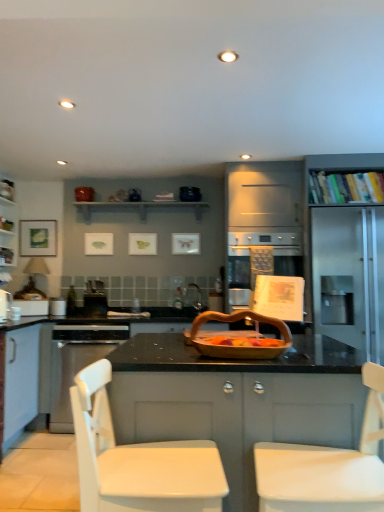
Question: Can you confirm if white matte cabinet at center, the second cabinetry positioned from the back, is taller than matte black shelf at upper center, the first shelf viewed from the left?

Choices:
 (A) yes
 (B) no

Answer: (A)

Question: Is matte black shelf at upper center, placed as the second shelf when sorted from right to left, located within white matte cabinet at center, which appears as the 1th cabinetry when viewed from the right?

Choices:
 (A) no
 (B) yes

Answer: (A)

Question: Considering the relative sizes of white matte cabinet at center, marked as the second cabinetry in a top-to-bottom arrangement, and matte black shelf at upper center, placed as the second shelf when sorted from right to left, in the image provided, is white matte cabinet at center, marked as the second cabinetry in a top-to-bottom arrangement, smaller than matte black shelf at upper center, placed as the second shelf when sorted from right to left,?

Choices:
 (A) yes
 (B) no

Answer: (B)

Question: Does white matte cabinet at center, which appears as the 1th cabinetry when viewed from the right, have a greater width compared to matte black shelf at upper center, the 1th shelf viewed from the back?

Choices:
 (A) yes
 (B) no

Answer: (A)

Question: Is white matte cabinet at center, positioned as the 1th cabinetry in front-to-back order, oriented away from matte black shelf at upper center, the first shelf viewed from the left?

Choices:
 (A) no
 (B) yes

Answer: (A)

Question: Is white matte cabinet at center, marked as the second cabinetry in a top-to-bottom arrangement, far from matte black shelf at upper center, the first shelf viewed from the left?

Choices:
 (A) no
 (B) yes

Answer: (B)

Question: Is brushed metal toaster at center, acting as the 1th appliance starting from the right, positioned behind matte white picture frame at left?

Choices:
 (A) yes
 (B) no

Answer: (B)

Question: Is brushed metal toaster at center, the 2th appliance viewed from the left, to the right of matte white picture frame at left from the viewer's perspective?

Choices:
 (A) no
 (B) yes

Answer: (B)

Question: Does brushed metal toaster at center, the 2th appliance viewed from the left, have a larger size compared to matte white picture frame at left?

Choices:
 (A) no
 (B) yes

Answer: (A)

Question: Does brushed metal toaster at center, the 2th appliance viewed from the left, have a lesser height compared to matte white picture frame at left?

Choices:
 (A) yes
 (B) no

Answer: (A)

Question: Is brushed metal toaster at center, the 2th appliance viewed from the left, taller than matte white picture frame at left?

Choices:
 (A) no
 (B) yes

Answer: (A)

Question: Could matte white picture frame at left be considered to be inside brushed metal toaster at center, acting as the 1th appliance starting from the right?

Choices:
 (A) yes
 (B) no

Answer: (B)

Question: Is metallic silver toaster at left, arranged as the second appliance when viewed from the back, positioned far away from matte black shelf at upper center, the first shelf viewed from the left?

Choices:
 (A) no
 (B) yes

Answer: (B)